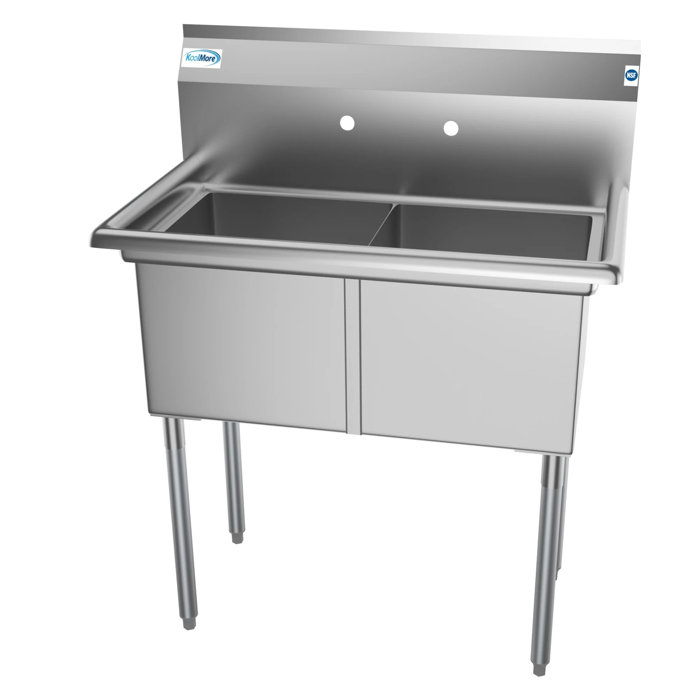
Find the location of a particular element. The width and height of the screenshot is (700, 700). divider is located at coordinates (379, 234).